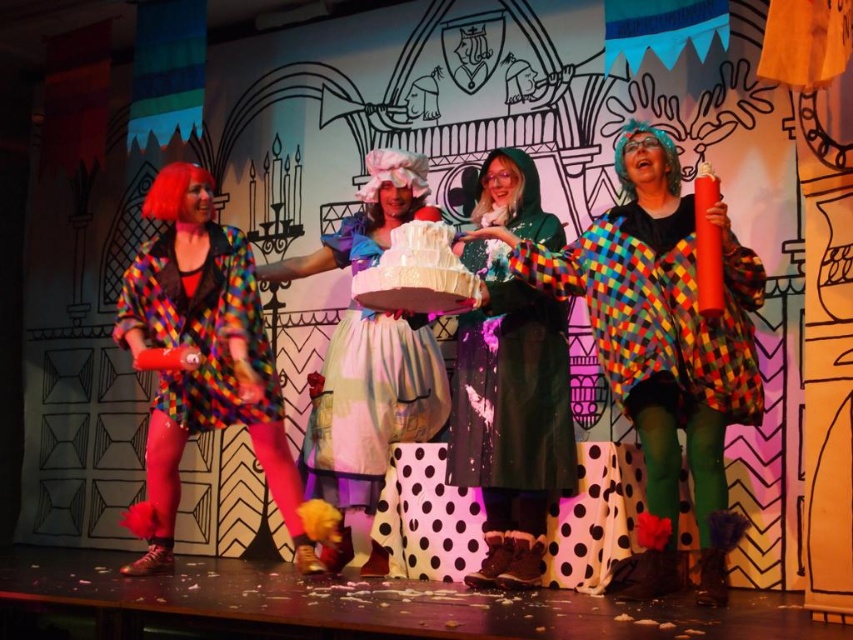
Question: Does multicolored fabric dress at left have a smaller size compared to matte white dress at center?

Choices:
 (A) yes
 (B) no

Answer: (A)

Question: Which object is the farthest from the green woolen coat at center?

Choices:
 (A) white polka dot skirt at center
 (B) matte white dress at center
 (C) multicolored patchwork coat at right

Answer: (B)

Question: Observing the image, what is the correct spatial positioning of multicolored fabric dress at left in reference to green woolen coat at center?

Choices:
 (A) left
 (B) right

Answer: (A)

Question: Which point is farther from the camera taking this photo?

Choices:
 (A) (469, 461)
 (B) (132, 532)
 (C) (323, 355)
 (D) (268, 420)

Answer: (C)

Question: Does white polka dot skirt at center have a larger size compared to multicolored patchwork coat at left?

Choices:
 (A) yes
 (B) no

Answer: (A)

Question: Which is nearer to the white polka dot skirt at center?

Choices:
 (A) green woolen coat at center
 (B) multicolored patchwork coat at left
 (C) multicolored fabric dress at left

Answer: (C)